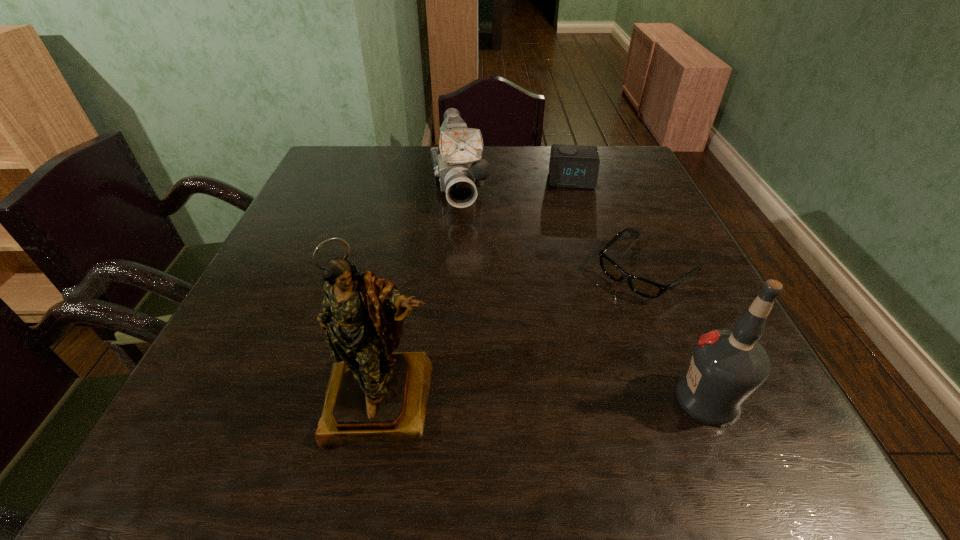
Identify the location of the tallest object. (373, 394).

Identify the location of the second tallest object. This screenshot has height=540, width=960. (728, 365).

This screenshot has width=960, height=540. In order to click on alarm clock in this screenshot , I will do `click(571, 166)`.

In order to click on camcorder in this screenshot , I will do `click(458, 167)`.

I want to click on spectacles, so click(643, 287).

Identify the location of the shortest object. This screenshot has width=960, height=540. (643, 287).

This screenshot has height=540, width=960. Identify the location of vacant region located 0.170m on the front label of the vodka. (571, 399).

Find the location of `free location located on the front label of the vodka`. free location located on the front label of the vodka is located at coordinates (443, 399).

You are a GUI agent. You are given a task and a screenshot of the screen. Output one action in this format:
    pyautogui.click(x=<x>, y=<y>)
    Task: Click on the free space located on the front label of the vodka
    
    Given the screenshot: What is the action you would take?
    pyautogui.click(x=578, y=399)

At what (x,y) coordinates should I click in order to perform the action: click on free region located 0.280m on the front-facing side of the alarm clock. Please return your answer as a coordinate pair (x, y). Looking at the image, I should click on (577, 254).